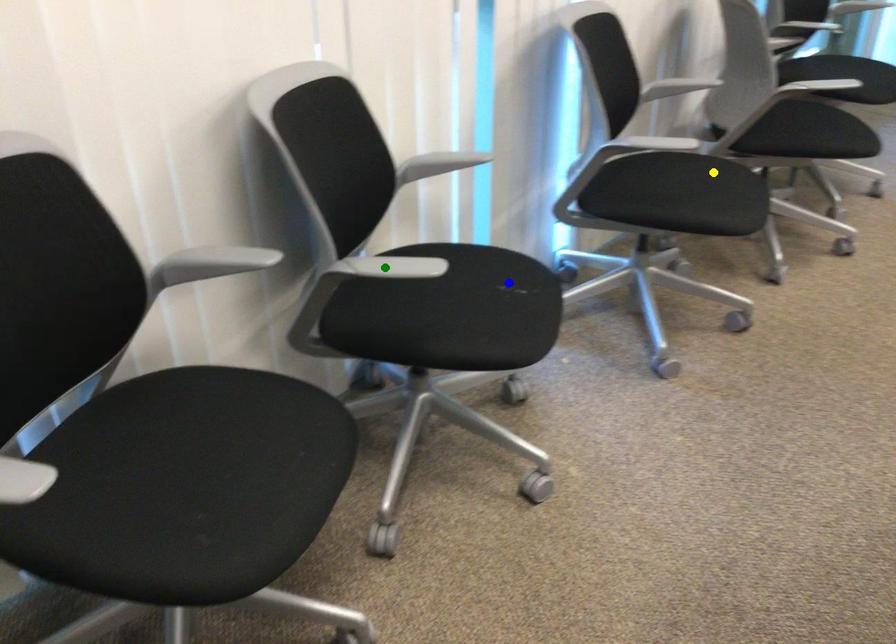
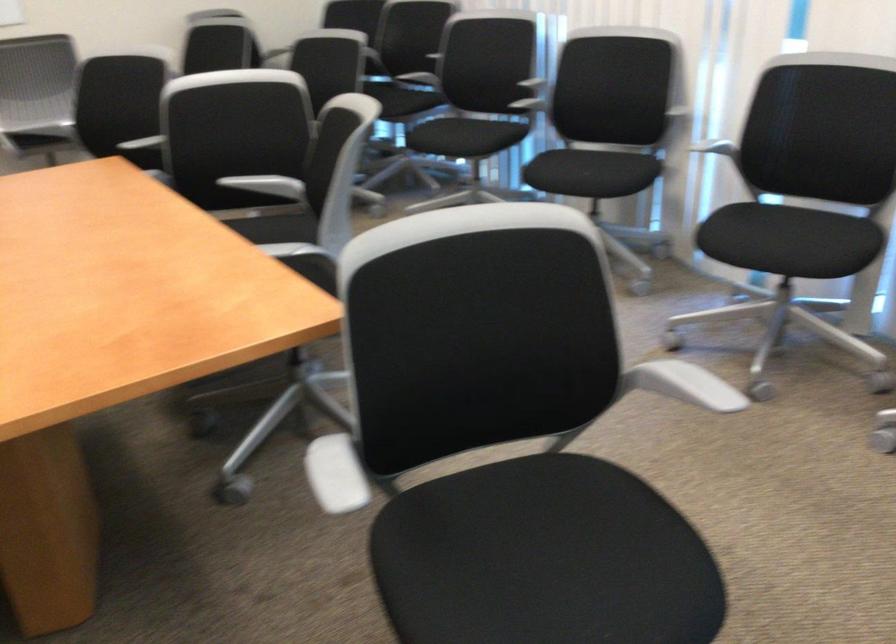
I am providing you with two images of the same scene from different viewpoints. Three points are marked in image1. Which point corresponds to a part or object that is occluded in image2?In image1, three points are marked. Which of them correspond to a part or object that is occluded in image2?Among the three points shown in image1, which one corresponds to a part or object that is no longer visible due to occlusion in image2?

green point cannot be seen in image2.